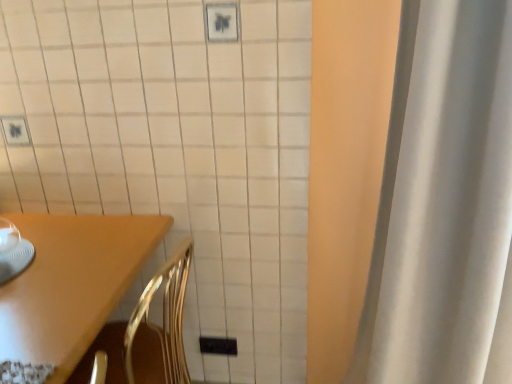
Locate an element on the screen. The height and width of the screenshot is (384, 512). white fabric curtain at right is located at coordinates (442, 199).

In order to face white fabric curtain at right, should I rotate leftwards or rightwards?

To face it directly, rotate right by 26.853 degrees.

What do you see at coordinates (442, 199) in the screenshot? This screenshot has height=384, width=512. I see `white fabric curtain at right` at bounding box center [442, 199].

Locate an element on the screen. The image size is (512, 384). wooden table at lower left is located at coordinates (71, 283).

This screenshot has height=384, width=512. What do you see at coordinates (71, 283) in the screenshot? I see `wooden table at lower left` at bounding box center [71, 283].

Locate an element on the screen. Image resolution: width=512 pixels, height=384 pixels. white fabric curtain at right is located at coordinates tap(442, 199).

Would you say white fabric curtain at right is to the left or to the right of wooden table at lower left in the picture?

Clearly, white fabric curtain at right is on the right of wooden table at lower left in the image.

Which is behind, white fabric curtain at right or wooden table at lower left?

wooden table at lower left is further away from the camera.

Does point (389, 158) lie in front of point (28, 221)?

Yes, it is in front of point (28, 221).

From the image's perspective, does white fabric curtain at right appear lower than wooden table at lower left?

Actually, white fabric curtain at right appears above wooden table at lower left in the image.

From a real-world perspective, is white fabric curtain at right located higher than wooden table at lower left?

Correct, in the physical world, white fabric curtain at right is higher than wooden table at lower left.

Which of these two, white fabric curtain at right or wooden table at lower left, is wider?

wooden table at lower left.

Does white fabric curtain at right have a lesser height compared to wooden table at lower left?

In fact, white fabric curtain at right may be taller than wooden table at lower left.

Based on their sizes in the image, would you say white fabric curtain at right is bigger or smaller than wooden table at lower left?

Clearly, white fabric curtain at right is smaller in size than wooden table at lower left.

Which is correct: white fabric curtain at right is inside wooden table at lower left, or outside of it?

white fabric curtain at right is outside wooden table at lower left.

Is white fabric curtain at right far away from wooden table at lower left?

That's not correct — white fabric curtain at right is a little close to wooden table at lower left.

Is white fabric curtain at right aimed at wooden table at lower left?

No, white fabric curtain at right does not turn towards wooden table at lower left.

How distant is white fabric curtain at right from wooden table at lower left?

34.33 inches.

Identify the location of furniture below the white fabric curtain at right (from the image's perspective). The height and width of the screenshot is (384, 512). point(71,283).

Is wooden table at lower left at the left side of white fabric curtain at right?

Correct, you'll find wooden table at lower left to the left of white fabric curtain at right.

Considering their positions, is wooden table at lower left located in front of or behind white fabric curtain at right?

wooden table at lower left is behind white fabric curtain at right.

Which point is more distant from viewer, (49, 291) or (416, 65)?

Positioned behind is point (49, 291).

From the image's perspective, does wooden table at lower left appear lower than white fabric curtain at right?

Yes.

From a real-world perspective, is wooden table at lower left positioned above or below white fabric curtain at right?

In terms of real-world spatial position, wooden table at lower left is below white fabric curtain at right.

Considering the relative sizes of wooden table at lower left and white fabric curtain at right in the image provided, is wooden table at lower left thinner than white fabric curtain at right?

Incorrect, the width of wooden table at lower left is not less than that of white fabric curtain at right.

Does wooden table at lower left have a greater height compared to white fabric curtain at right?

No.

Considering the sizes of objects wooden table at lower left and white fabric curtain at right in the image provided, who is bigger, wooden table at lower left or white fabric curtain at right?

wooden table at lower left.

Is wooden table at lower left inside or outside of white fabric curtain at right?

wooden table at lower left is outside white fabric curtain at right.

Is wooden table at lower left with white fabric curtain at right?

No, wooden table at lower left is not beside white fabric curtain at right.

Is wooden table at lower left aimed at white fabric curtain at right?

Yes, wooden table at lower left is facing white fabric curtain at right.

How distant is wooden table at lower left from white fabric curtain at right?

They are 34.33 inches apart.

This screenshot has width=512, height=384. In order to click on furniture located behind the white fabric curtain at right in this screenshot , I will do `click(71, 283)`.

Where is `curtain above the wooden table at lower left (from the image's perspective)`? The width and height of the screenshot is (512, 384). curtain above the wooden table at lower left (from the image's perspective) is located at coordinates (442, 199).

Where is `curtain positioned vertically above the wooden table at lower left (from a real-world perspective)`? The height and width of the screenshot is (384, 512). curtain positioned vertically above the wooden table at lower left (from a real-world perspective) is located at coordinates (442, 199).